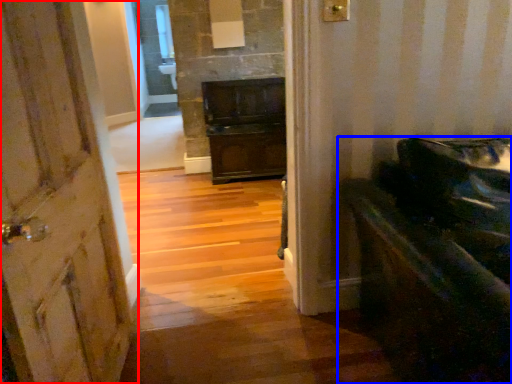
Question: Among these objects, which one is nearest to the camera, door (highlighted by a red box) or furniture (highlighted by a blue box)?

Choices:
 (A) door
 (B) furniture

Answer: (A)